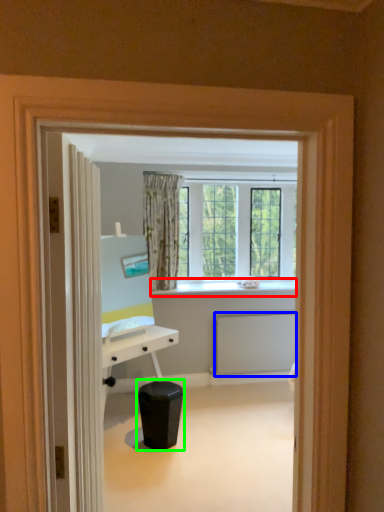
Question: Which object is positioned closest to window sill (highlighted by a red box)? Select from radiator (highlighted by a blue box) and music stool (highlighted by a green box).

Choices:
 (A) radiator
 (B) music stool

Answer: (A)